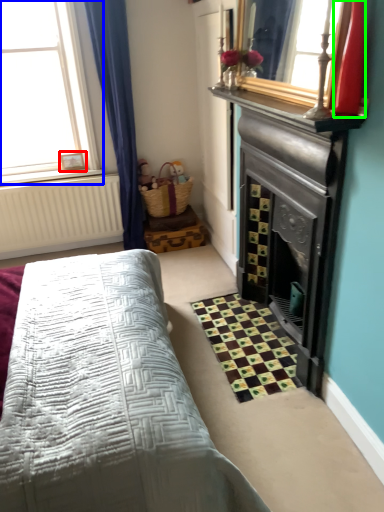
Question: Based on their relative distances, which object is farther from picture frame (highlighted by a red box)? Choose from window (highlighted by a blue box) and chiffonier (highlighted by a green box).

Choices:
 (A) window
 (B) chiffonier

Answer: (B)